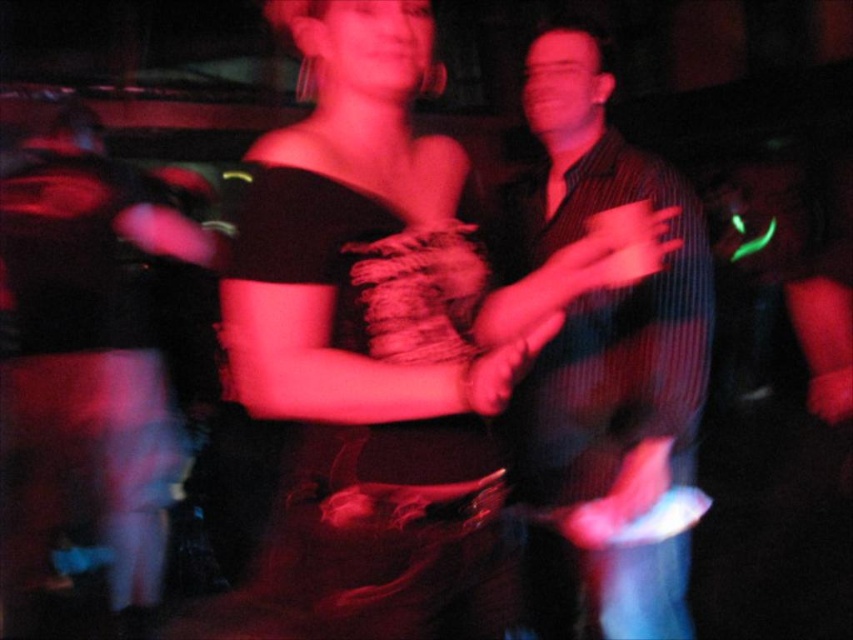
Is matte black dress at center below striped shirt at center?

Indeed, matte black dress at center is positioned under striped shirt at center.

Between point (352, 150) and point (567, 428), which one is positioned behind?

Positioned behind is point (567, 428).

Is point (279, 260) behind point (672, 330)?

No, it is not.

The height and width of the screenshot is (640, 853). I want to click on matte black dress at center, so pos(386,340).

Does matte black dress at center have a lesser width compared to velvet-like black dress at center?

In fact, matte black dress at center might be wider than velvet-like black dress at center.

Where is `matte black dress at center`? This screenshot has width=853, height=640. matte black dress at center is located at coordinates (386, 340).

Measure the distance between matte black dress at center and camera.

The distance of matte black dress at center from camera is 38.00 inches.

Where is `matte black dress at center`? This screenshot has height=640, width=853. matte black dress at center is located at coordinates (386, 340).

Describe the element at coordinates (386, 536) in the screenshot. This screenshot has height=640, width=853. I see `velvet-like black dress at center` at that location.

This screenshot has width=853, height=640. Find the location of `velvet-like black dress at center`. velvet-like black dress at center is located at coordinates (386, 536).

Find the location of a particular element. Image resolution: width=853 pixels, height=640 pixels. velvet-like black dress at center is located at coordinates (386, 536).